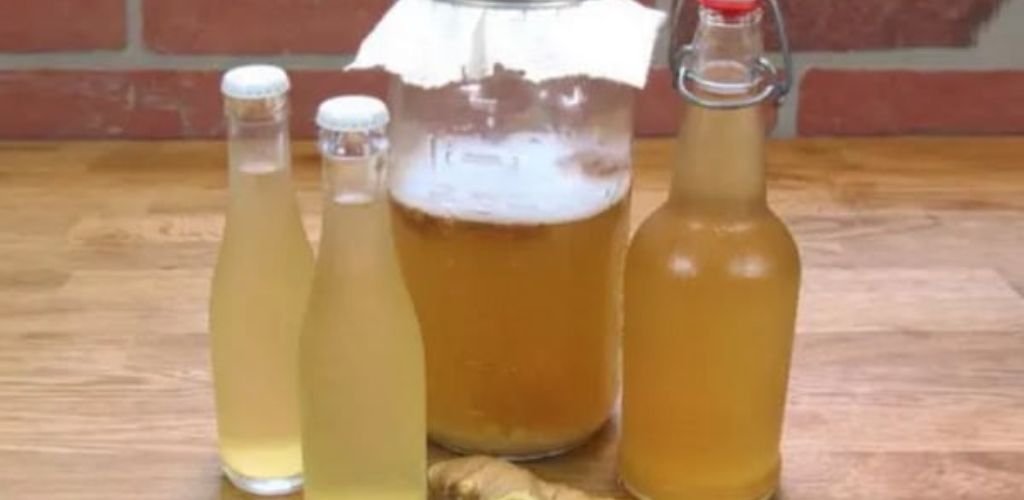
Find the location of `wood counter`. wood counter is located at coordinates (103, 298).